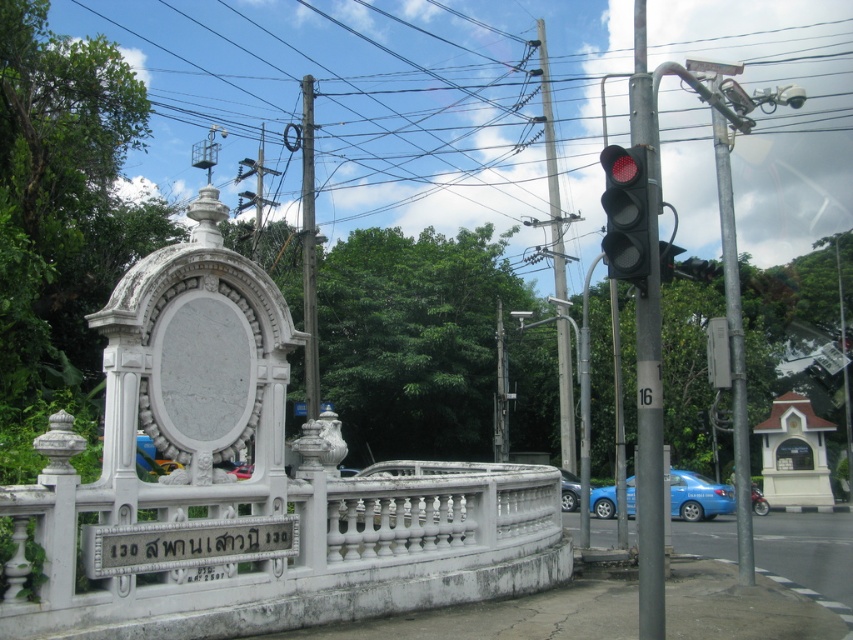
Looking at this image, is matte black traffic light at upper right shorter than metallic pole at upper center?

Correct, matte black traffic light at upper right is not as tall as metallic pole at upper center.

Does matte black traffic light at upper right come behind metallic pole at upper center?

No, it is in front of metallic pole at upper center.

The image size is (853, 640). Describe the element at coordinates (625, 212) in the screenshot. I see `matte black traffic light at upper right` at that location.

In order to click on matte black traffic light at upper right in this screenshot , I will do `click(625, 212)`.

Between black plastic traffic light at right and white stone sign at lower center, which one appears on the left side from the viewer's perspective?

From the viewer's perspective, white stone sign at lower center appears more on the left side.

Identify the location of black plastic traffic light at right. The image size is (853, 640). (648, 358).

The height and width of the screenshot is (640, 853). What are the coordinates of `black plastic traffic light at right` in the screenshot? It's located at (648, 358).

Is point (573, 506) farther from viewer compared to point (752, 490)?

No, it is not.

Who is higher up, blue glossy car at lower center or blue metallic car at lower right?

Positioned higher is blue metallic car at lower right.

This screenshot has width=853, height=640. Find the location of `blue glossy car at lower center`. blue glossy car at lower center is located at coordinates (569, 490).